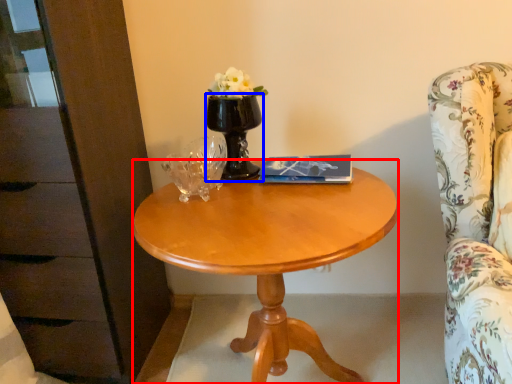
Question: Which of the following is the closest to the observer, desk (highlighted by a red box) or vase (highlighted by a blue box)?

Choices:
 (A) desk
 (B) vase

Answer: (A)